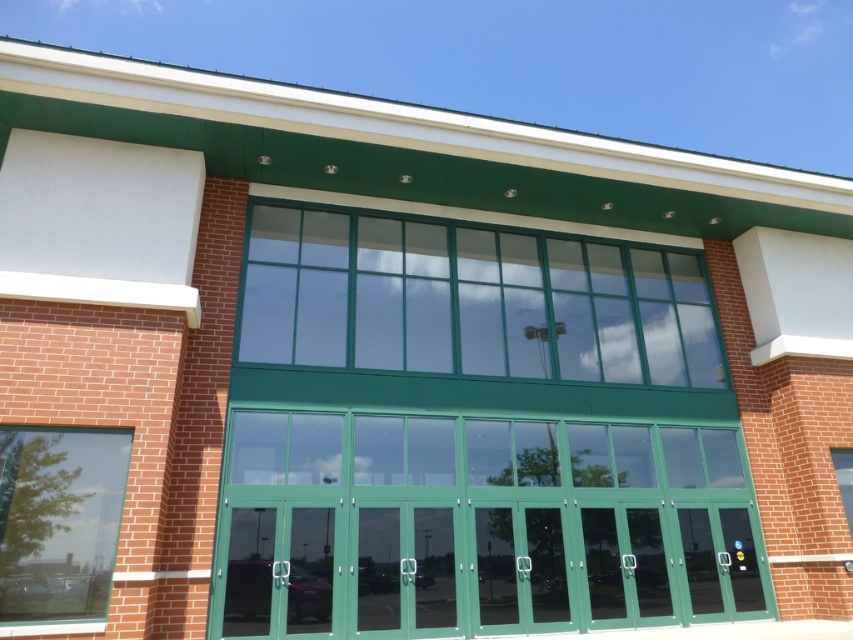
Question: Is green glass window at center thinner than clear glass window at lower left?

Choices:
 (A) yes
 (B) no

Answer: (A)

Question: Can you confirm if green glass window at center is bigger than clear glass window at lower left?

Choices:
 (A) no
 (B) yes

Answer: (A)

Question: Where is green glass window at center located in relation to clear glass window at lower left in the image?

Choices:
 (A) below
 (B) above

Answer: (B)

Question: Which of the following is the farthest from the observer?

Choices:
 (A) clear glass window at lower left
 (B) green glass window at center

Answer: (B)

Question: Which object appears closest to the camera in this image?

Choices:
 (A) clear glass window at lower left
 (B) green glass window at center

Answer: (A)

Question: Which point is farther to the camera?

Choices:
 (A) green glass window at center
 (B) clear glass window at lower left

Answer: (A)